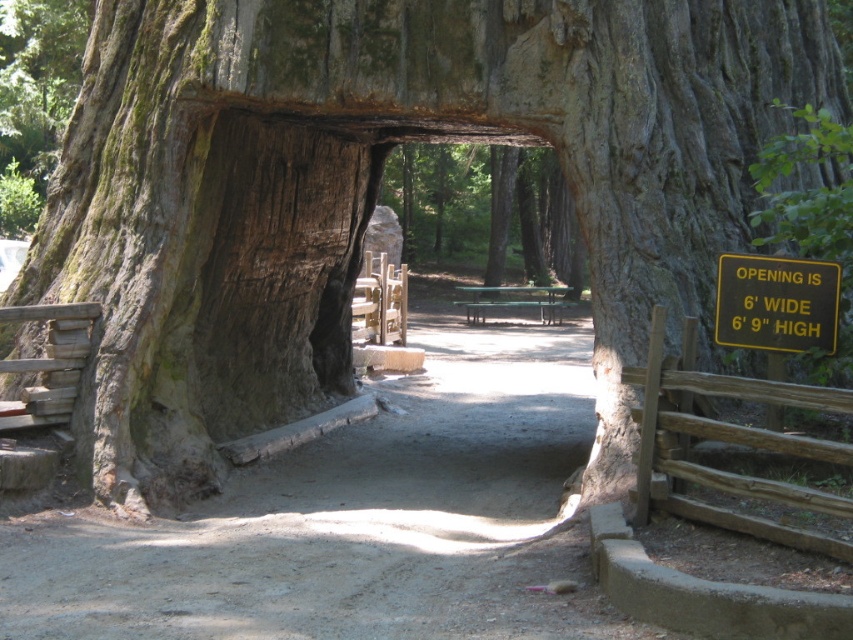
Question: Among these objects, which one is nearest to the camera?

Choices:
 (A) green wooden bench at center
 (B) yellowmaterial/texturesign at upper right
 (C) dirt path at center

Answer: (C)

Question: Is dirt path at center thinner than yellowmaterial/texturesign at upper right?

Choices:
 (A) no
 (B) yes

Answer: (A)

Question: Based on their relative distances, which object is nearer to the green wooden bench at center?

Choices:
 (A) yellowmaterial/texturesign at upper right
 (B) dirt path at center

Answer: (B)

Question: Which point appears closest to the camera in this image?

Choices:
 (A) (561, 435)
 (B) (523, 291)

Answer: (A)

Question: Is dirt path at center to the left of green wooden bench at center from the viewer's perspective?

Choices:
 (A) yes
 (B) no

Answer: (A)

Question: Can you confirm if dirt path at center is positioned to the right of yellowmaterial/texturesign at upper right?

Choices:
 (A) yes
 (B) no

Answer: (B)